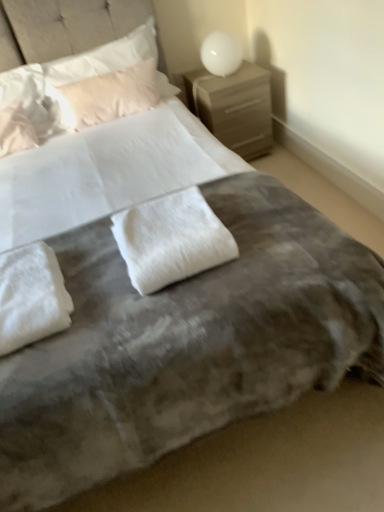
Question: Is white fluffy pillow at upper left, positioned as the 4th pillow in front-to-back order, bigger than white fluffy pillow at upper left, the third pillow from the front?

Choices:
 (A) no
 (B) yes

Answer: (B)

Question: Considering the relative sizes of white fluffy pillow at upper left, marked as the third pillow in a back-to-front arrangement, and white fluffy pillow at upper left, which ranks as the fourth pillow in back-to-front order, in the image provided, is white fluffy pillow at upper left, marked as the third pillow in a back-to-front arrangement, taller than white fluffy pillow at upper left, which ranks as the fourth pillow in back-to-front order,?

Choices:
 (A) no
 (B) yes

Answer: (B)

Question: Can you confirm if white fluffy pillow at upper left, marked as the third pillow in a back-to-front arrangement, is positioned to the left of white fluffy pillow at upper left, which ranks as the fourth pillow in back-to-front order?

Choices:
 (A) yes
 (B) no

Answer: (B)

Question: From a real-world perspective, is white fluffy pillow at upper left, positioned as the 4th pillow in front-to-back order, beneath white fluffy pillow at upper left, the third pillow from the front?

Choices:
 (A) no
 (B) yes

Answer: (A)

Question: Is white fluffy pillow at upper left, marked as the third pillow in a back-to-front arrangement, not near white fluffy pillow at upper left, the third pillow from the front?

Choices:
 (A) no
 (B) yes

Answer: (A)

Question: From a real-world perspective, is white fluffy pillow at upper left, marked as the third pillow in a back-to-front arrangement, on white fluffy pillow at upper left, which ranks as the fourth pillow in back-to-front order?

Choices:
 (A) yes
 (B) no

Answer: (A)

Question: Does white fluffy pillow at center, the 5th pillow viewed from the back, have a greater width compared to light pink satin pillow at upper left, the sixth pillow positioned from the front?

Choices:
 (A) yes
 (B) no

Answer: (A)

Question: Considering the relative sizes of white fluffy pillow at center, positioned as the second pillow in front-to-back order, and light pink satin pillow at upper left, which is counted as the 1th pillow, starting from the back, in the image provided, is white fluffy pillow at center, positioned as the second pillow in front-to-back order, thinner than light pink satin pillow at upper left, which is counted as the 1th pillow, starting from the back,?

Choices:
 (A) no
 (B) yes

Answer: (A)

Question: From the image's perspective, is white fluffy pillow at center, the 5th pillow viewed from the back, below light pink satin pillow at upper left, which is counted as the 1th pillow, starting from the back?

Choices:
 (A) no
 (B) yes

Answer: (B)

Question: Is white fluffy pillow at center, the 5th pillow viewed from the back, not within light pink satin pillow at upper left, the sixth pillow positioned from the front?

Choices:
 (A) yes
 (B) no

Answer: (A)

Question: Considering the relative positions of white fluffy pillow at center, positioned as the second pillow in front-to-back order, and light pink satin pillow at upper left, the sixth pillow positioned from the front, in the image provided, is white fluffy pillow at center, positioned as the second pillow in front-to-back order, to the right of light pink satin pillow at upper left, the sixth pillow positioned from the front, from the viewer's perspective?

Choices:
 (A) yes
 (B) no

Answer: (A)

Question: Is white fluffy pillow at center, positioned as the second pillow in front-to-back order, looking in the opposite direction of light pink satin pillow at upper left, the sixth pillow positioned from the front?

Choices:
 (A) yes
 (B) no

Answer: (A)

Question: Is the position of white glossy sphere at upper right less distant than that of white fluffy pillow at center, positioned as the second pillow in front-to-back order?

Choices:
 (A) no
 (B) yes

Answer: (A)